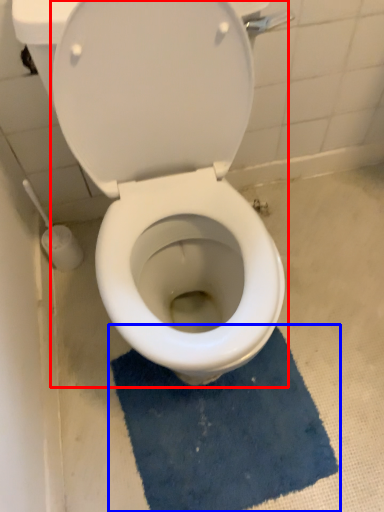
Question: Which of the following is the farthest to the observer, toilet (highlighted by a red box) or bath mat (highlighted by a blue box)?

Choices:
 (A) toilet
 (B) bath mat

Answer: (B)